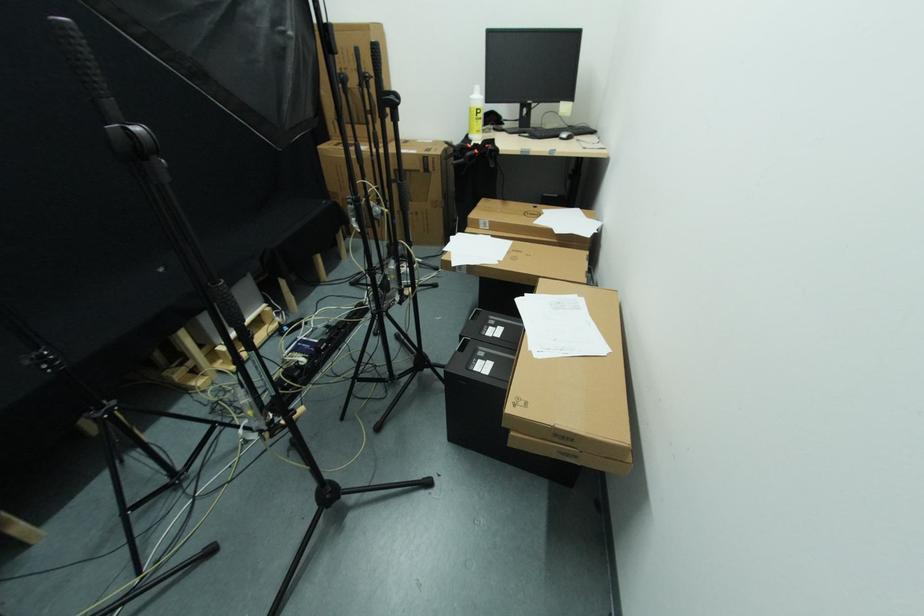
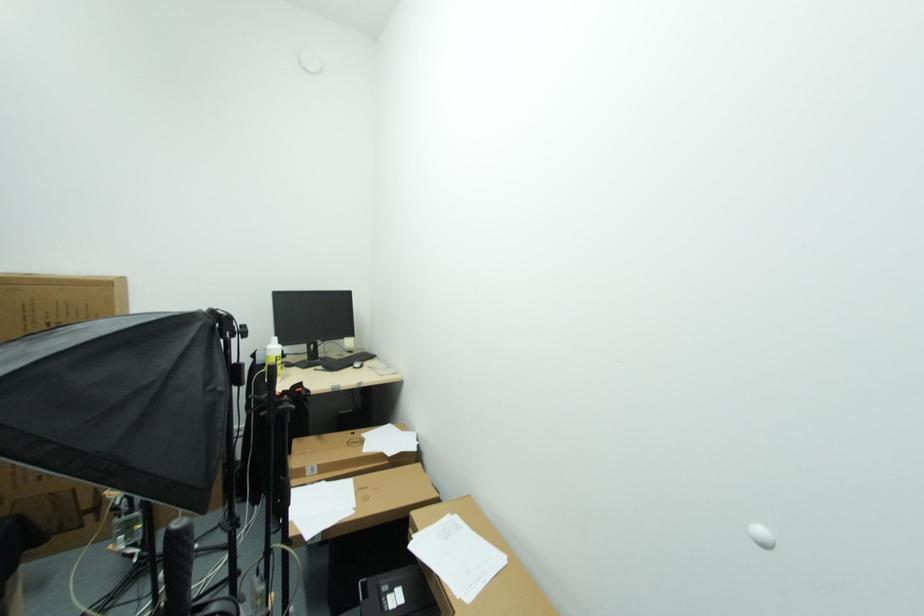
Find the pixel in the second image that matches (540,358) in the first image.

(470, 602)